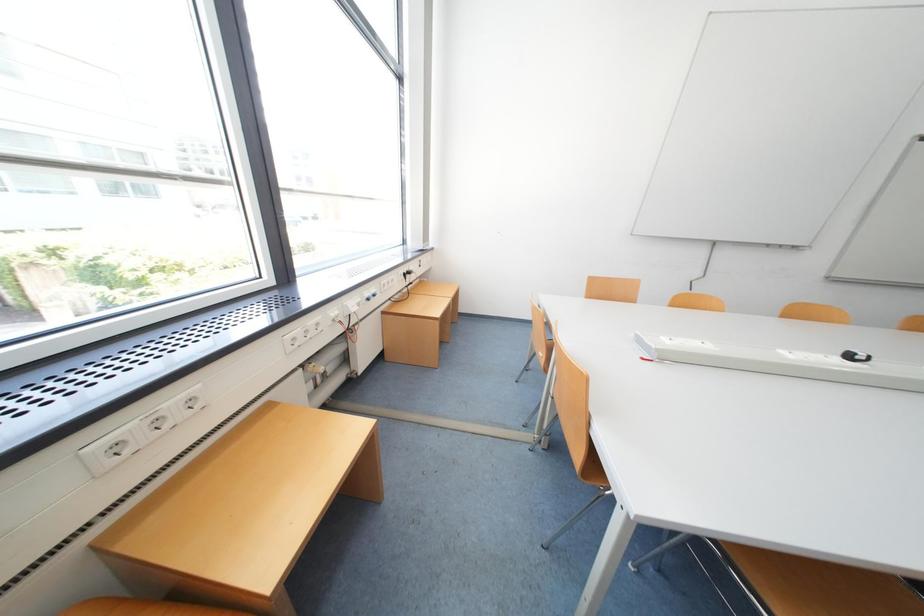
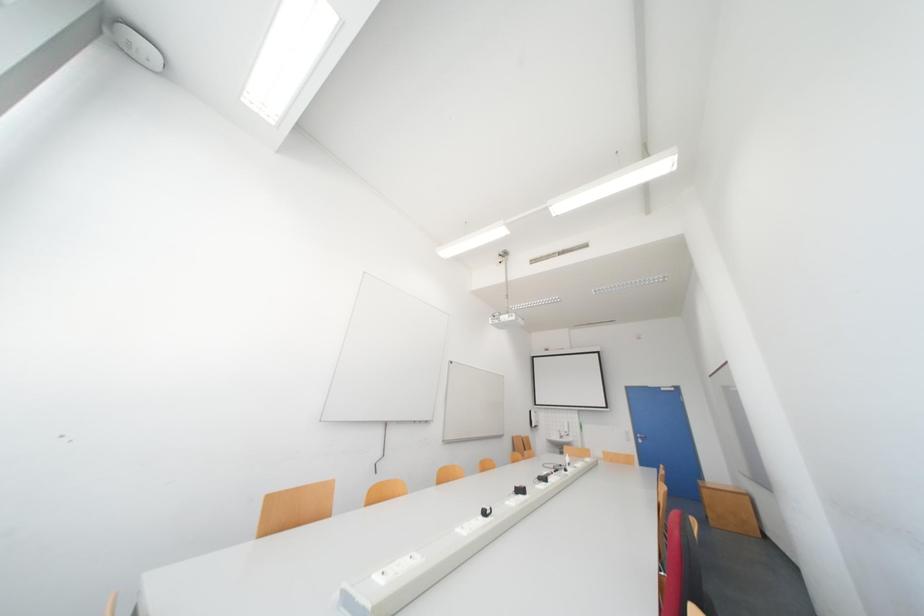
The first image is from the beginning of the video and the second image is from the end. How did the camera likely rotate when shooting the video?

The camera's rotation is toward right-up.